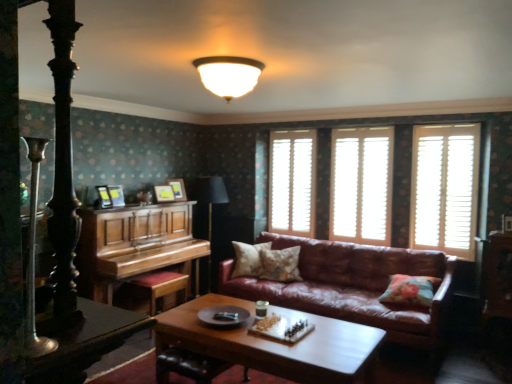
Where is `free point above floral fabric pillow at center, which appears as the first pillow when viewed from the back (from a real-world perspective)`? This screenshot has height=384, width=512. free point above floral fabric pillow at center, which appears as the first pillow when viewed from the back (from a real-world perspective) is located at coordinates (254, 247).